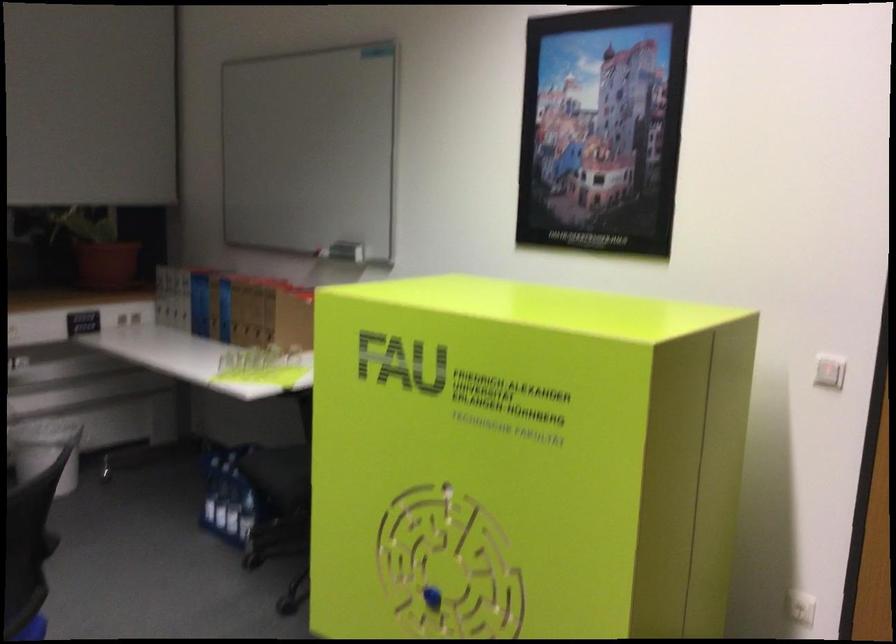
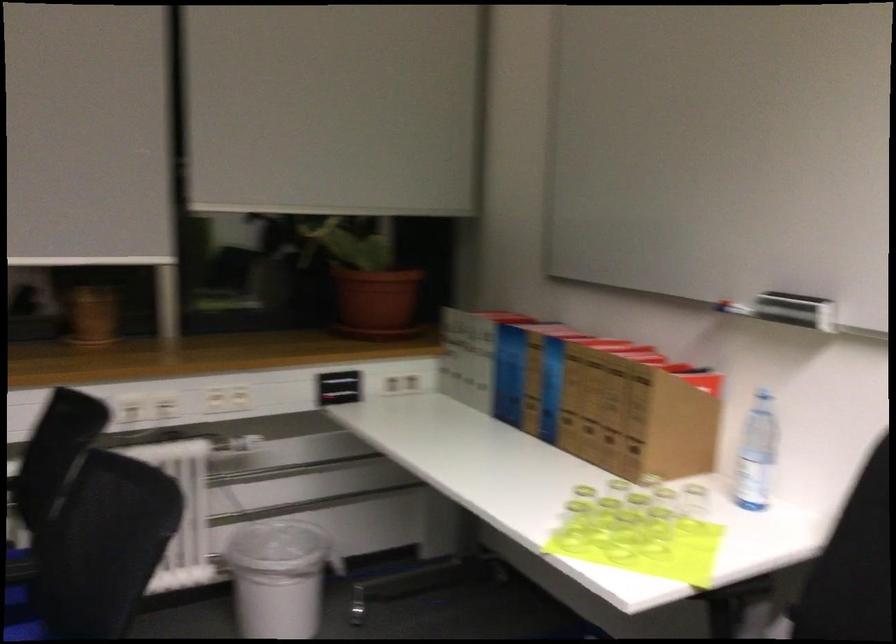
In the second image, find the point that corresponds to the point at 272,317 in the first image.

(634, 417)